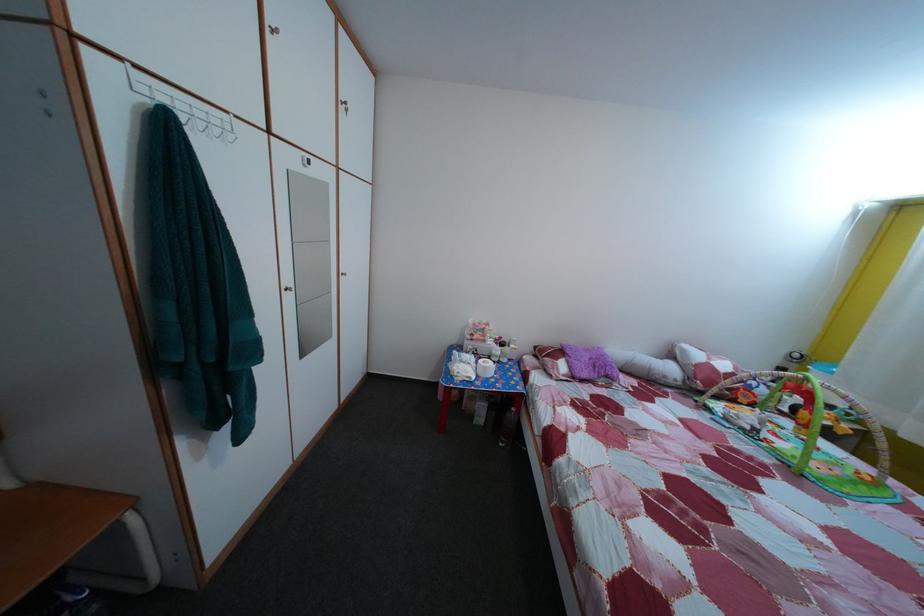
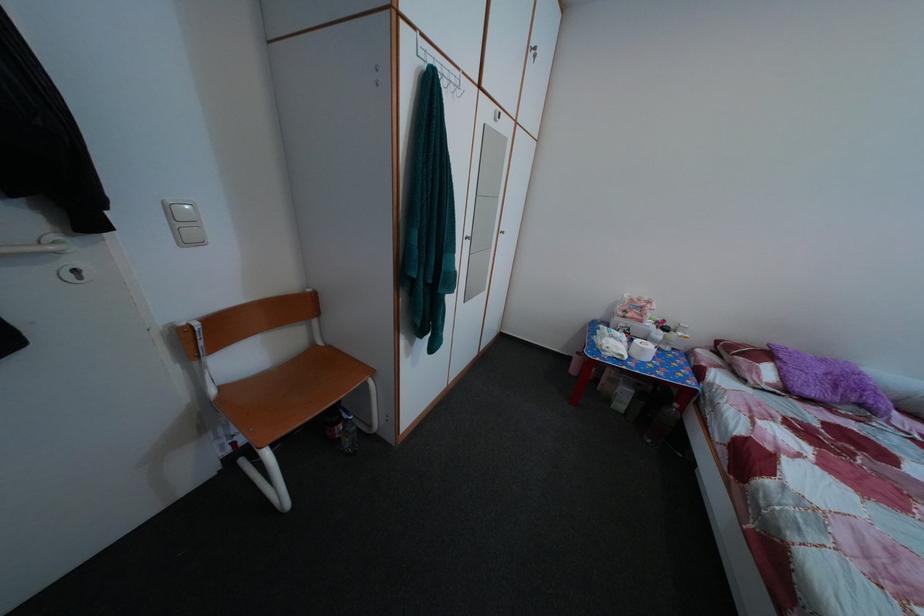
Question: The images are taken continuously from a first-person perspective. In which direction are you moving?

Choices:
 (A) Left
 (B) Right
 (C) Forward
 (D) Backward

Answer: (A)